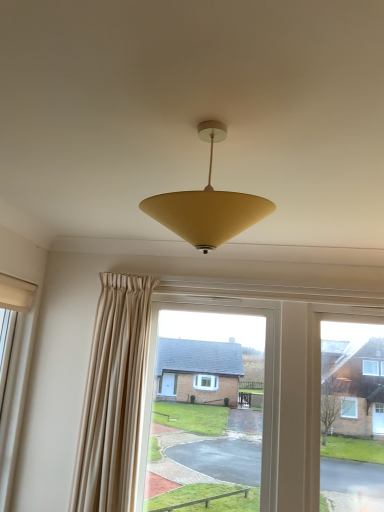
What do you see at coordinates (207, 205) in the screenshot? I see `matte yellow cone at center` at bounding box center [207, 205].

This screenshot has height=512, width=384. I want to click on matte yellow cone at center, so click(207, 205).

Find the location of `white matte window at left`. white matte window at left is located at coordinates 16,393.

Describe the element at coordinates (16, 393) in the screenshot. This screenshot has height=512, width=384. I see `white matte window at left` at that location.

This screenshot has height=512, width=384. I want to click on matte yellow cone at center, so click(207, 205).

Which object is positioned more to the left, white matte window at left or matte yellow cone at center?

From the viewer's perspective, white matte window at left appears more on the left side.

Is white matte window at left positioned behind matte yellow cone at center?

Yes, it is.

Which point is more forward, (x=27, y=285) or (x=189, y=242)?

The point (x=189, y=242) is closer to the camera.

From the image's perspective, between white matte window at left and matte yellow cone at center, which one is located above?

matte yellow cone at center, from the image's perspective.

From a real-world perspective, which is physically above, white matte window at left or matte yellow cone at center?

matte yellow cone at center.

Which object is thinner, white matte window at left or matte yellow cone at center?

With smaller width is white matte window at left.

Considering the sizes of white matte window at left and matte yellow cone at center in the image, is white matte window at left taller or shorter than matte yellow cone at center?

Considering their sizes, white matte window at left has more height than matte yellow cone at center.

Considering the relative sizes of white matte window at left and matte yellow cone at center in the image provided, is white matte window at left smaller than matte yellow cone at center?

Actually, white matte window at left might be larger than matte yellow cone at center.

Is matte yellow cone at center inside white matte window at left?

No, white matte window at left does not contain matte yellow cone at center.

Are white matte window at left and matte yellow cone at center far apart?

That's right, there is a large distance between white matte window at left and matte yellow cone at center.

Is white matte window at left looking in the opposite direction of matte yellow cone at center?

No.

How many degrees apart are the facing directions of white matte window at left and matte yellow cone at center?

They differ by 82 degrees in their facing directions.

In order to click on lamp above the white matte window at left (from a real-world perspective) in this screenshot , I will do coord(207,205).

Is matte yellow cone at center to the left or to the right of white matte window at left in the image?

matte yellow cone at center is positioned on white matte window at left's right side.

Does matte yellow cone at center come behind white matte window at left?

No, matte yellow cone at center is closer to the viewer.

Which point is more forward, (213, 122) or (0, 470)?

Positioned in front is point (213, 122).

From the image's perspective, is matte yellow cone at center located above white matte window at left?

Yes, from the image's perspective, matte yellow cone at center is over white matte window at left.

From a real-world perspective, between matte yellow cone at center and white matte window at left, who is vertically lower?

white matte window at left.

Considering the sizes of objects matte yellow cone at center and white matte window at left in the image provided, who is thinner, matte yellow cone at center or white matte window at left?

Thinner between the two is white matte window at left.

Considering the sizes of objects matte yellow cone at center and white matte window at left in the image provided, who is taller, matte yellow cone at center or white matte window at left?

Standing taller between the two is white matte window at left.

Who is smaller, matte yellow cone at center or white matte window at left?

With smaller size is matte yellow cone at center.

Is matte yellow cone at center surrounding white matte window at left?

That's incorrect, white matte window at left is not inside matte yellow cone at center.

Is matte yellow cone at center in contact with white matte window at left?

No, matte yellow cone at center is not in contact with white matte window at left.

Could you tell me if matte yellow cone at center is turned towards white matte window at left?

No, matte yellow cone at center is not turned towards white matte window at left.

How different are the orientations of matte yellow cone at center and white matte window at left in degrees?

82 degrees separate the facing orientations of matte yellow cone at center and white matte window at left.

How far apart are matte yellow cone at center and white matte window at left?

matte yellow cone at center is 5.80 feet from white matte window at left.

Identify the location of lamp lying on the right of white matte window at left. (207, 205).

The height and width of the screenshot is (512, 384). In order to click on window that is on the left side of matte yellow cone at center in this screenshot , I will do `click(16, 393)`.

Image resolution: width=384 pixels, height=512 pixels. I want to click on lamp on the right of white matte window at left, so click(207, 205).